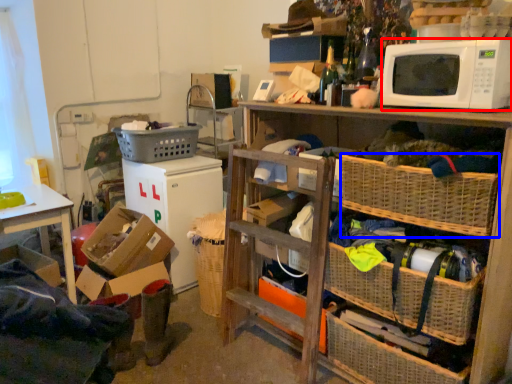
Question: Which of the following is the farthest to the observer, microwave oven (highlighted by a red box) or picnic basket (highlighted by a blue box)?

Choices:
 (A) microwave oven
 (B) picnic basket

Answer: (B)